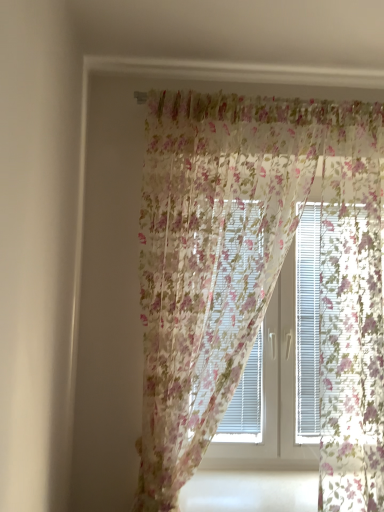
This screenshot has width=384, height=512. Find the location of `floral sheer curtain at center`. floral sheer curtain at center is located at coordinates (257, 275).

Describe the element at coordinates (257, 275) in the screenshot. Image resolution: width=384 pixels, height=512 pixels. I see `floral sheer curtain at center` at that location.

Where is `floral sheer curtain at center`? The image size is (384, 512). floral sheer curtain at center is located at coordinates (257, 275).